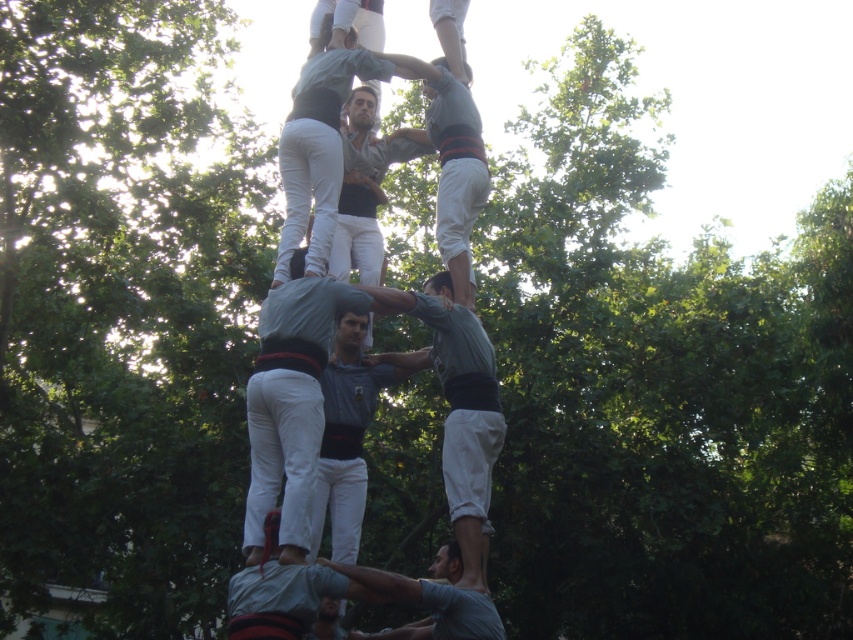
You are a photographer trying to capture the human tower formation. You notice two participants wearing shirts labeled as matte gray shirt at center and gray cotton shirt at lower center. Which participant is positioned higher in the tower?

The matte gray shirt at center is taller than the gray cotton shirt at lower center, so the participant wearing the matte gray shirt at center is positioned higher in the tower.

You are a photographer standing at the camera position. You want to take a closeup shot of the matte gray shirt at center. Considering the distance between you and the shirt, is it feasible to capture a clear closeup without moving closer?

The distance between the matte gray shirt at center and the camera is 30.32 meters. To capture a clear closeup from that distance, you would need a telephoto lens with sufficient zoom capability. Without moving closer, it might be challenging to achieve a sharp and detailed closeup due to the significant distance involved.